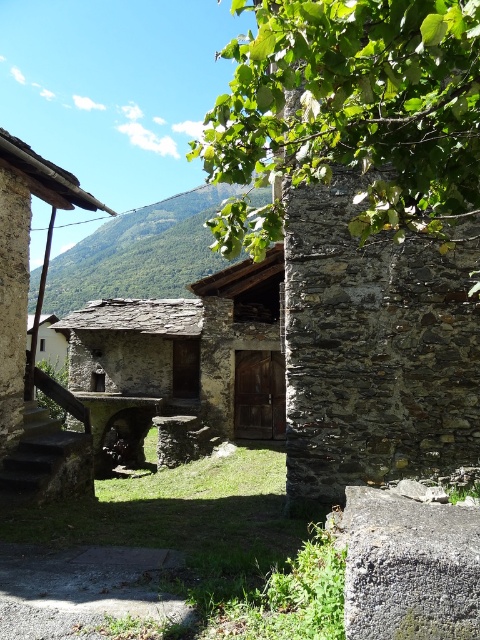
Question: Does rustic stone hut at left have a smaller size compared to green leafy mountain at upper center?

Choices:
 (A) no
 (B) yes

Answer: (A)

Question: Which of the following is the farthest from the observer?

Choices:
 (A) (4, 150)
 (B) (52, 282)
 (C) (420, 506)
 (D) (158, 452)

Answer: (B)

Question: Which object appears closest to the camera in this image?

Choices:
 (A) green leafy mountain at upper center
 (B) rustic stone hut at left

Answer: (B)

Question: Is green leafy tree at upper center thinner than gray rough stone at center?

Choices:
 (A) yes
 (B) no

Answer: (B)

Question: Estimate the real-world distances between objects in this image. Which object is closer to the rustic stone hut at center?

Choices:
 (A) green leafy tree at upper center
 (B) green leafy mountain at upper center

Answer: (A)

Question: Does green leafy tree at upper center appear on the right side of rustic stone hut at left?

Choices:
 (A) no
 (B) yes

Answer: (B)